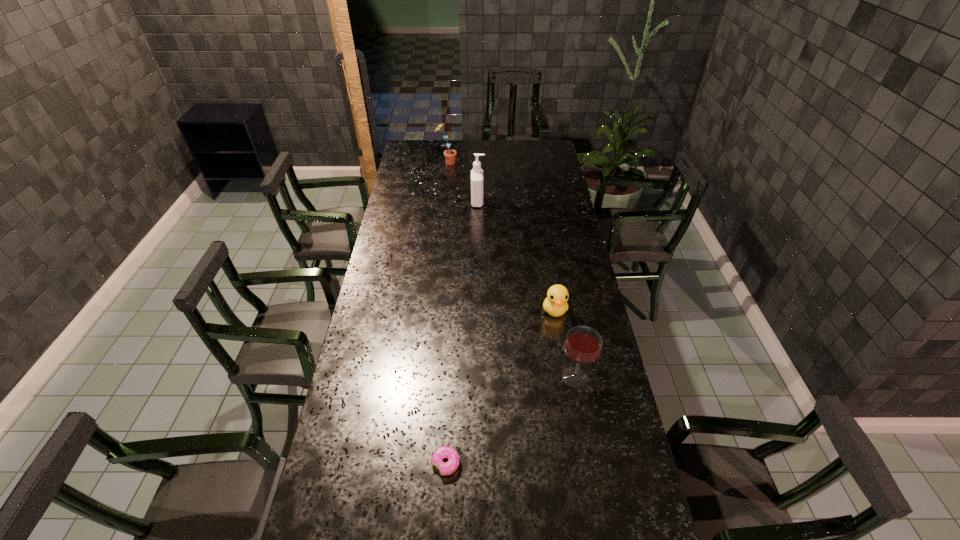
Find the location of a particular element. object that is the closest to the third object from left to right is located at coordinates (450, 155).

I want to click on vacant space that satisfies the following two spatial constraints: 1. on the front label of the third object from left to right; 2. on the front side of the doughnut, so click(x=476, y=463).

This screenshot has width=960, height=540. What are the coordinates of `vacant area in the image that satisfies the following two spatial constraints: 1. on the back side of the shortest object; 2. on the flower of the sunflower` in the screenshot? It's located at (463, 163).

Where is `vacant region that satisfies the following two spatial constraints: 1. on the front label of the cleansing agent; 2. on the front side of the doughnut`? The image size is (960, 540). vacant region that satisfies the following two spatial constraints: 1. on the front label of the cleansing agent; 2. on the front side of the doughnut is located at coordinates pos(476,463).

The height and width of the screenshot is (540, 960). Find the location of `vacant space that satisfies the following two spatial constraints: 1. on the flower of the second nearest object; 2. on the right side of the sunflower`. vacant space that satisfies the following two spatial constraints: 1. on the flower of the second nearest object; 2. on the right side of the sunflower is located at coordinates (424, 377).

You are a GUI agent. You are given a task and a screenshot of the screen. Output one action in this format:
    pyautogui.click(x=<x>, y=<y>)
    Task: Click on the vacant region that satisfies the following two spatial constraints: 1. on the front label of the cleansing agent; 2. on the left side of the fourth farthest object
    
    Given the screenshot: What is the action you would take?
    pyautogui.click(x=477, y=377)

Locate an element on the screen. free space that satisfies the following two spatial constraints: 1. on the flower of the farthest object; 2. on the left side of the fourth farthest object is located at coordinates (424, 377).